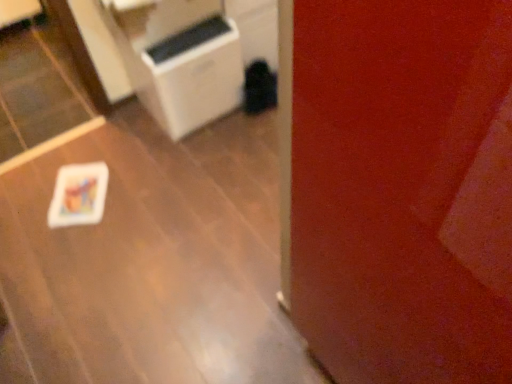
Question: From a real-world perspective, is white plastic air purifier at center positioned above or below white glossy table at lower left?

Choices:
 (A) below
 (B) above

Answer: (B)

Question: In the image, is white plastic air purifier at center positioned in front of or behind white glossy table at lower left?

Choices:
 (A) behind
 (B) front

Answer: (A)

Question: Considering the relative positions of white plastic air purifier at center and white glossy table at lower left in the image provided, is white plastic air purifier at center to the left or to the right of white glossy table at lower left?

Choices:
 (A) left
 (B) right

Answer: (B)

Question: Looking at the image, does white glossy table at lower left seem bigger or smaller compared to white plastic air purifier at center?

Choices:
 (A) small
 (B) big

Answer: (A)

Question: Choose the correct answer: Is white glossy table at lower left inside white plastic air purifier at center or outside it?

Choices:
 (A) inside
 (B) outside

Answer: (B)

Question: Is white glossy table at lower left in front of or behind white plastic air purifier at center in the image?

Choices:
 (A) front
 (B) behind

Answer: (A)

Question: Would you say white glossy table at lower left is to the left or to the right of white plastic air purifier at center in the picture?

Choices:
 (A) right
 (B) left

Answer: (B)